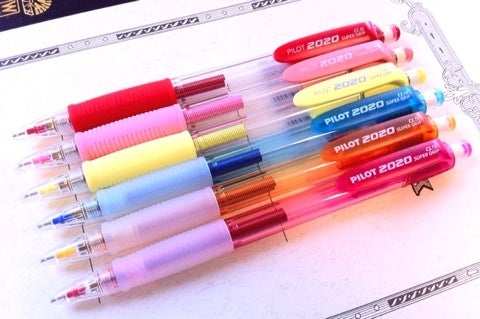
Image resolution: width=480 pixels, height=319 pixels. I want to click on finger cushions, so click(161, 257), click(157, 217), click(148, 189), click(141, 156), click(137, 130), click(136, 104).